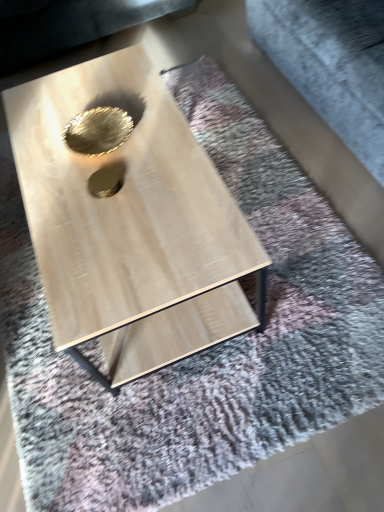
In order to click on free location in front of gold metallic hole at center, which appears as the 2th hole when ordered from the bottom in this screenshot , I will do `click(117, 195)`.